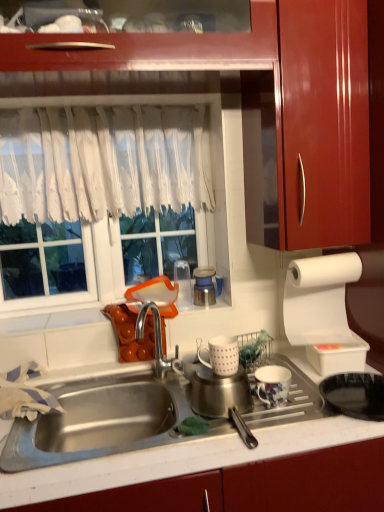
Image resolution: width=384 pixels, height=512 pixels. Find the location of `empty space that is ontop of white lace curtain at upper center`. empty space that is ontop of white lace curtain at upper center is located at coordinates (60, 106).